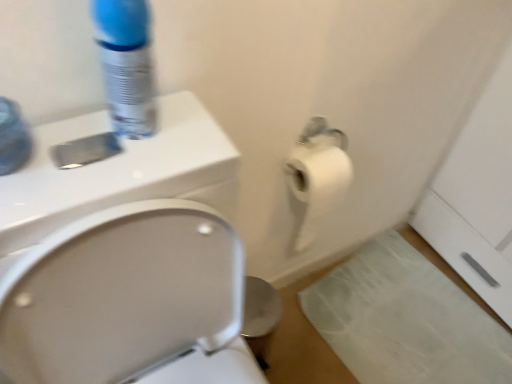
Where is `free location to the right of metallic silver spray can at upper left`? free location to the right of metallic silver spray can at upper left is located at coordinates (192, 138).